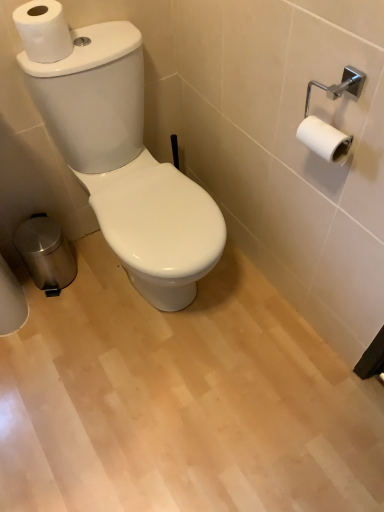
Identify the location of free location in front of white glossy toilet at center. (155, 394).